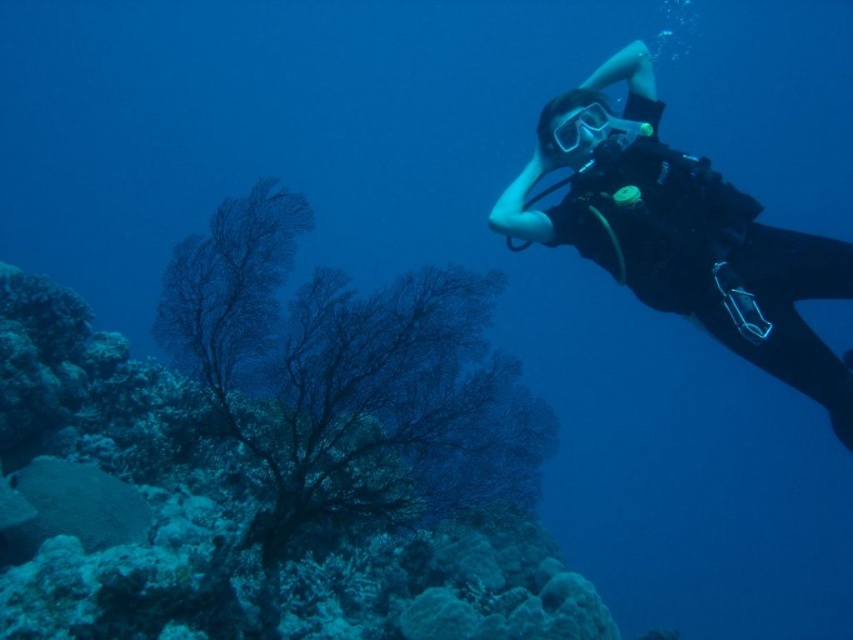
Is dark green coral at lower left positioned in front of black matte scuba diver at right?

Yes, dark green coral at lower left is closer to the viewer.

You are a GUI agent. You are given a task and a screenshot of the screen. Output one action in this format:
    pyautogui.click(x=<x>, y=<y>)
    Task: Click on the dark green coral at lower left
    
    Given the screenshot: What is the action you would take?
    pyautogui.click(x=218, y=518)

Can you confirm if dark green coral at lower left is smaller than transparent rubber goggles at upper right?

Incorrect, dark green coral at lower left is not smaller in size than transparent rubber goggles at upper right.

Is dark green coral at lower left bigger than transparent rubber goggles at upper right?

Yes.

Who is more distant from viewer, [190,467] or [566,120]?

Positioned behind is point [566,120].

Image resolution: width=853 pixels, height=640 pixels. Identify the location of dark green coral at lower left. (218, 518).

Is black matte scuba diver at right above transparent rubber goggles at upper right?

Actually, black matte scuba diver at right is below transparent rubber goggles at upper right.

From the picture: Between black matte scuba diver at right and transparent rubber goggles at upper right, which one appears on the right side from the viewer's perspective?

Positioned to the right is black matte scuba diver at right.

Where is `black matte scuba diver at right`? This screenshot has width=853, height=640. black matte scuba diver at right is located at coordinates (685, 237).

Where is `black matte scuba diver at right`? This screenshot has height=640, width=853. black matte scuba diver at right is located at coordinates (685, 237).